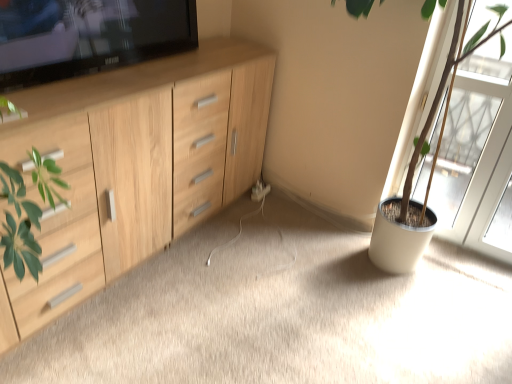
In the scene shown: In order to face wooden cabinet at left, should I rotate leftwards or rightwards?

Turn right by 6.946 degrees to look at wooden cabinet at left.

Measure the distance between light wood cabinet at left and camera.

The distance of light wood cabinet at left from camera is 38.43 inches.

What is the approximate height of white plastic electric outlet at center?

2.40 inches.

Where is `wooden cabinet at left`? The height and width of the screenshot is (384, 512). wooden cabinet at left is located at coordinates (281, 314).

Considering the relative sizes of transparent glass screen door at right and white plastic electric outlet at center in the image provided, is transparent glass screen door at right shorter than white plastic electric outlet at center?

Incorrect, the height of transparent glass screen door at right does not fall short of that of white plastic electric outlet at center.

Would you say transparent glass screen door at right contains white plastic electric outlet at center?

No, white plastic electric outlet at center is not surrounded by transparent glass screen door at right.

In the scene shown: From the image's perspective, is transparent glass screen door at right below white plastic electric outlet at center?

Incorrect, from the image's perspective, transparent glass screen door at right is higher than white plastic electric outlet at center.

Is transparent glass screen door at right aimed at white plastic electric outlet at center?

No, transparent glass screen door at right does not turn towards white plastic electric outlet at center.

Considering the positions of objects wooden cabinet at left and white plastic electric outlet at center in the image provided, who is more to the left, wooden cabinet at left or white plastic electric outlet at center?

From the viewer's perspective, white plastic electric outlet at center appears more on the left side.

Does wooden cabinet at left have a greater width compared to white plastic electric outlet at center?

Indeed, wooden cabinet at left has a greater width compared to white plastic electric outlet at center.

Which is correct: wooden cabinet at left is inside white plastic electric outlet at center, or outside of it?

wooden cabinet at left is not inside white plastic electric outlet at center, it's outside.

Considering the sizes of transparent glass screen door at right and wooden cabinet at left in the image, is transparent glass screen door at right wider or thinner than wooden cabinet at left?

In the image, transparent glass screen door at right appears to be more narrow than wooden cabinet at left.

From the image's perspective, would you say transparent glass screen door at right is positioned over wooden cabinet at left?

Correct, transparent glass screen door at right appears higher than wooden cabinet at left in the image.

Between transparent glass screen door at right and wooden cabinet at left, which one has larger size?

wooden cabinet at left is bigger.

Does transparent glass screen door at right have a greater height compared to wooden cabinet at left?

Yes, transparent glass screen door at right is taller than wooden cabinet at left.

From the image's perspective, is light wood cabinet at left under green matte plant pot at right?

Correct, light wood cabinet at left appears lower than green matte plant pot at right in the image.

Considering the points (77, 189) and (431, 223), which point is in front, point (77, 189) or point (431, 223)?

Point (77, 189)

Considering the sizes of objects light wood cabinet at left and green matte plant pot at right in the image provided, who is bigger, light wood cabinet at left or green matte plant pot at right?

With larger size is light wood cabinet at left.

Considering the relative sizes of light wood cabinet at left and green matte plant pot at right in the image provided, is light wood cabinet at left taller than green matte plant pot at right?

Incorrect, the height of light wood cabinet at left is not larger of that of green matte plant pot at right.

Could you tell me if white plastic electric outlet at center is facing light wood cabinet at left?

Yes, white plastic electric outlet at center is facing light wood cabinet at left.

Which point is more distant from viewer, (259,187) or (164,161)?

The point (259,187) is farther from the camera.

Does white plastic electric outlet at center have a greater width compared to light wood cabinet at left?

No.

Find the location of a particular element. The width and height of the screenshot is (512, 384). electric outlet that is behind the light wood cabinet at left is located at coordinates (259, 191).

Does wooden cabinet at left have a lesser height compared to transparent glass screen door at right?

Indeed, wooden cabinet at left has a lesser height compared to transparent glass screen door at right.

Is wooden cabinet at left wider than transparent glass screen door at right?

Yes.

From a real-world perspective, does wooden cabinet at left sit lower than transparent glass screen door at right?

Yes.

Is light wood cabinet at left looking in the opposite direction of white plastic electric outlet at center?

That's not correct — light wood cabinet at left is not looking away from white plastic electric outlet at center.

Between light wood cabinet at left and white plastic electric outlet at center, which one appears on the right side from the viewer's perspective?

From the viewer's perspective, white plastic electric outlet at center appears more on the right side.

How many degrees apart are the facing directions of light wood cabinet at left and white plastic electric outlet at center?

5.5 degrees separate the facing orientations of light wood cabinet at left and white plastic electric outlet at center.

Where is `electric outlet below the transparent glass screen door at right (from the image's perspective)`? The image size is (512, 384). electric outlet below the transparent glass screen door at right (from the image's perspective) is located at coordinates (259, 191).

At what (x,y) coordinates should I click in order to perform the action: click on electric outlet that appears above the wooden cabinet at left (from a real-world perspective). Please return your answer as a coordinate pair (x, y). Looking at the image, I should click on (259, 191).

When comparing their distances from light wood cabinet at left, does transparent glass screen door at right or wooden cabinet at left seem further?

Based on the image, transparent glass screen door at right appears to be further to light wood cabinet at left.

Looking at this image, when comparing their distances from transparent glass screen door at right, does green matte plant pot at right or wooden cabinet at left seem further?

wooden cabinet at left is positioned further to the anchor transparent glass screen door at right.

Looking at the image, which one is located further to white plastic electric outlet at center, transparent glass screen door at right or light wood cabinet at left?

transparent glass screen door at right is positioned further to the anchor white plastic electric outlet at center.

From the image, which object appears to be farther from transparent glass screen door at right, wooden cabinet at left or green matte plant pot at right?

wooden cabinet at left.

Considering their positions, is transparent glass screen door at right positioned further to wooden cabinet at left than green matte plant pot at right?

Based on the image, transparent glass screen door at right appears to be further to wooden cabinet at left.

Based on their spatial positions, is light wood cabinet at left or green matte plant pot at right closer to transparent glass screen door at right?

Based on the image, green matte plant pot at right appears to be nearer to transparent glass screen door at right.

Which object lies further to the anchor point green matte plant pot at right, white plastic electric outlet at center or transparent glass screen door at right?

white plastic electric outlet at center lies further to green matte plant pot at right than the other object.

Estimate the real-world distances between objects in this image. Which object is further from light wood cabinet at left, green matte plant pot at right or white plastic electric outlet at center?

green matte plant pot at right.

Locate an element on the screen. houseplant between wooden cabinet at left and transparent glass screen door at right from front to back is located at coordinates (411, 185).

Locate an element on the screen. This screenshot has height=384, width=512. plain located between light wood cabinet at left and green matte plant pot at right in the left-right direction is located at coordinates (281, 314).

Locate an element on the screen. This screenshot has width=512, height=384. plain situated between light wood cabinet at left and transparent glass screen door at right from left to right is located at coordinates (281, 314).

Identify the location of houseplant between wooden cabinet at left and white plastic electric outlet at center along the z-axis. click(x=411, y=185).